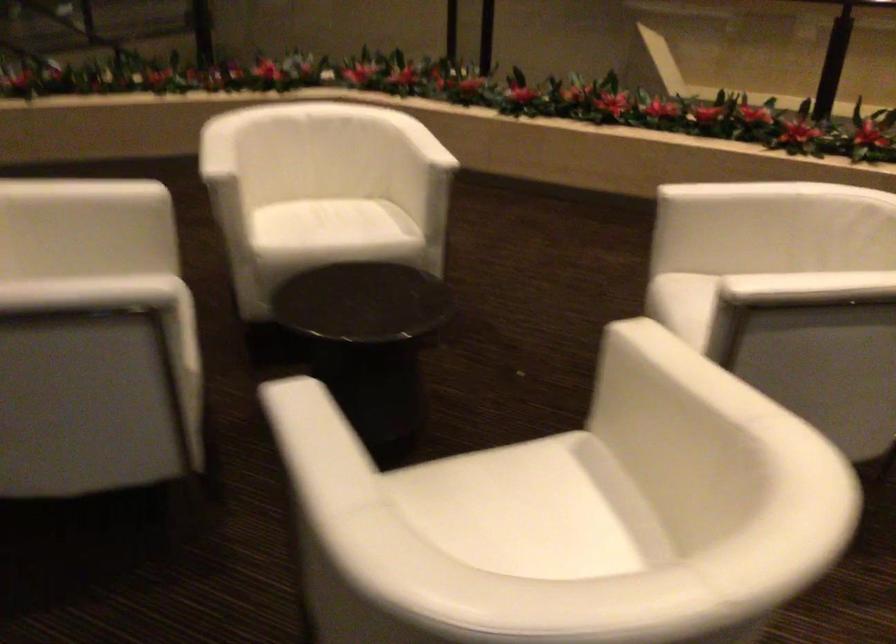
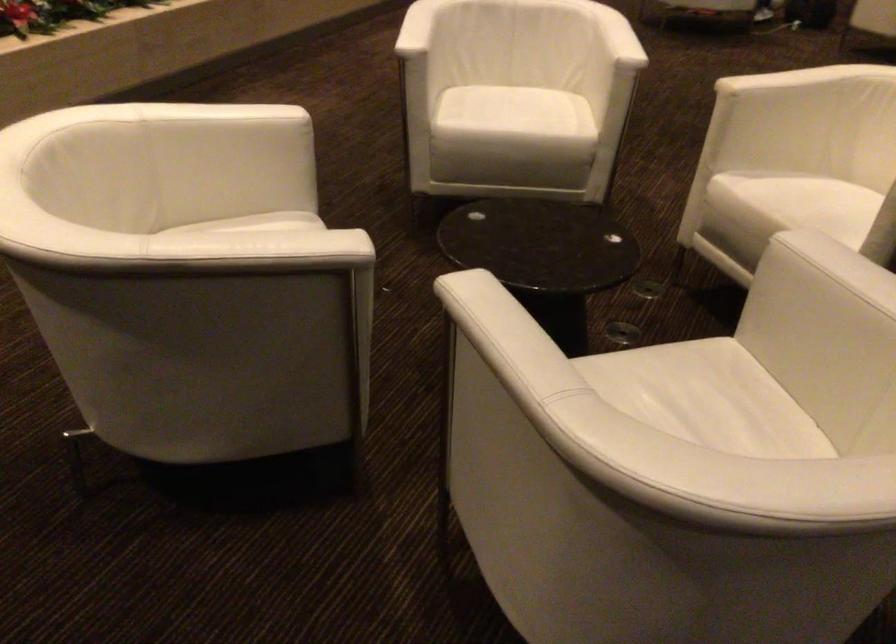
Where in the second image is the point corresponding to pixel 660 372 from the first image?

(789, 80)